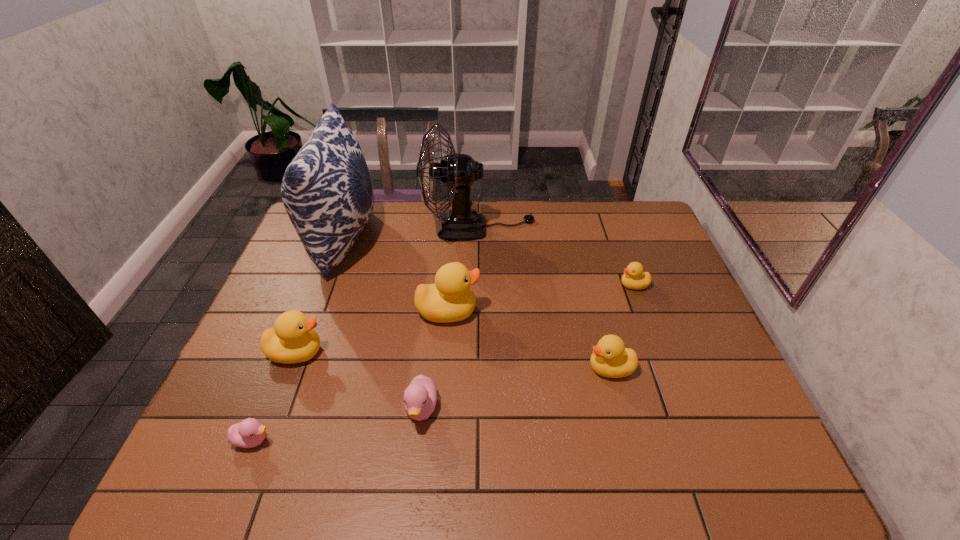
You are a GUI agent. You are given a task and a screenshot of the screen. Output one action in this format:
    pyautogui.click(x=<x>, y=<y>)
    Task: Click on the object that is positioned at the near left corner
    
    Given the screenshot: What is the action you would take?
    pyautogui.click(x=249, y=433)

In the image, there is a desktop. Identify the location of vacant space at the far edge. The image size is (960, 540). (588, 206).

Where is `vacant space at the near edge of the desktop`? This screenshot has width=960, height=540. vacant space at the near edge of the desktop is located at coordinates 500,446.

Where is `vacant space at the right edge`? vacant space at the right edge is located at coordinates (679, 320).

Where is `vacant space at the near left corner`? vacant space at the near left corner is located at coordinates (232, 483).

Identify the location of free space at the far right corner of the desktop. This screenshot has height=540, width=960. (636, 207).

In the image, there is a desktop. Identify the location of vacant space at the near right corner. (713, 450).

Find the location of a particular element. empty space that is in between the fan and the seventh object from left to right is located at coordinates (544, 298).

At what (x,y) coordinates should I click in order to perform the action: click on vacant space that is in between the fifth shortest object and the bigger pink duckling. Please return your answer as a coordinate pair (x, y). The height and width of the screenshot is (540, 960). Looking at the image, I should click on (x=359, y=380).

The image size is (960, 540). Identify the location of free space between the smallest yellow duckling and the blue cushion. (489, 262).